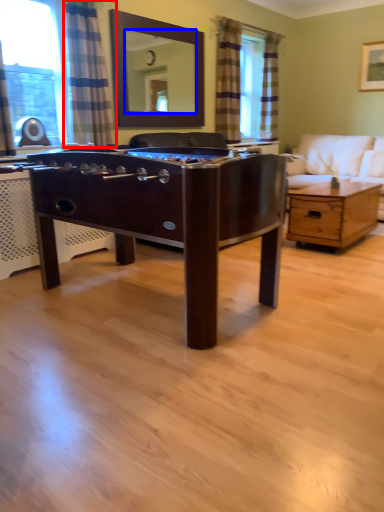
Question: Among these objects, which one is farthest to the camera, curtain (highlighted by a red box) or mirror (highlighted by a blue box)?

Choices:
 (A) curtain
 (B) mirror

Answer: (B)